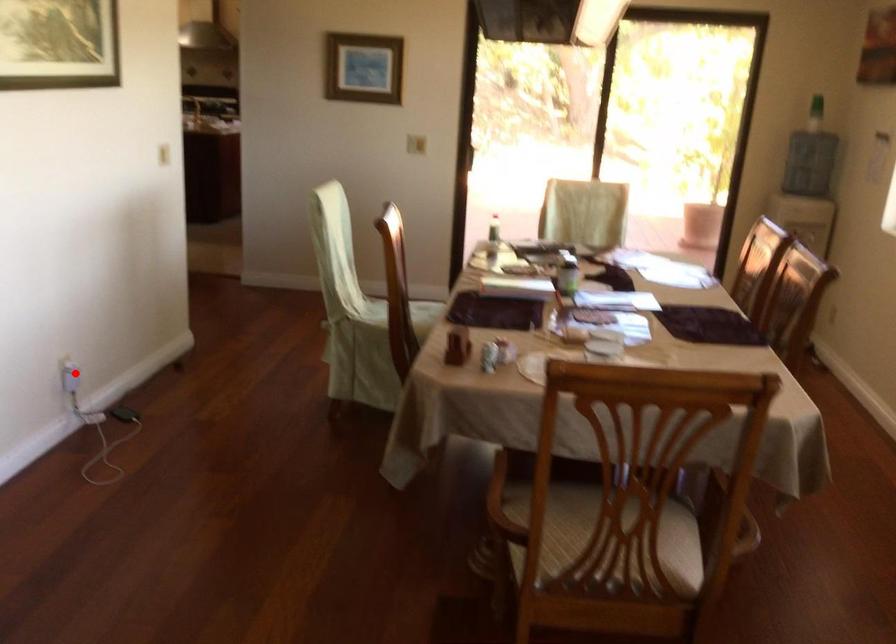
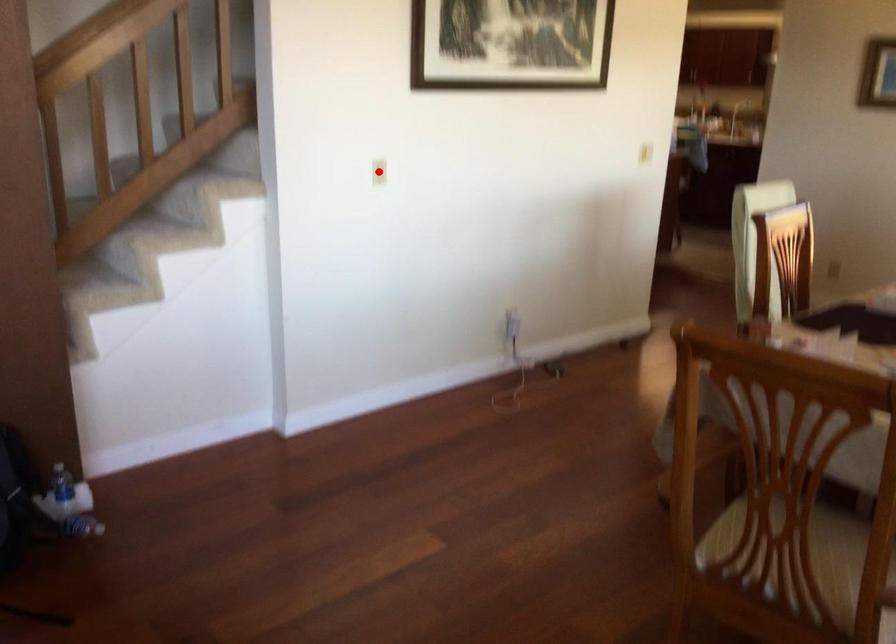
I am providing you with two images of the same scene from different viewpoints. A red point is marked on the first image and another point is marked on the second image. Is the red point in image1 aligned with the point shown in image2?

No